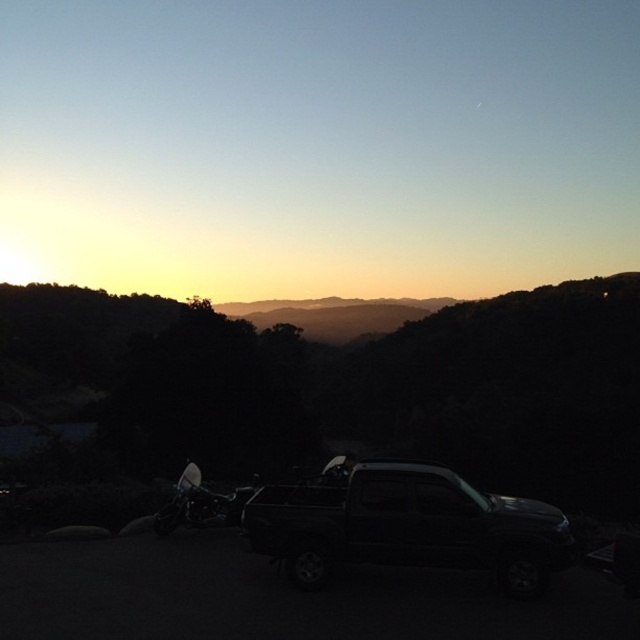
Question: In this image, where is black matte truck at center located relative to shiny black motorcycle at lower left?

Choices:
 (A) below
 (B) above

Answer: (B)

Question: Which of the following is the farthest from the observer?

Choices:
 (A) (234, 515)
 (B) (460, 497)

Answer: (A)

Question: Does black matte truck at center lie in front of shiny black motorcycle at lower left?

Choices:
 (A) no
 (B) yes

Answer: (B)

Question: Is the position of black matte truck at center less distant than that of shiny black motorcycle at lower left?

Choices:
 (A) yes
 (B) no

Answer: (A)

Question: Among these points, which one is nearest to the camera?

Choices:
 (A) (332, 493)
 (B) (179, 509)

Answer: (A)